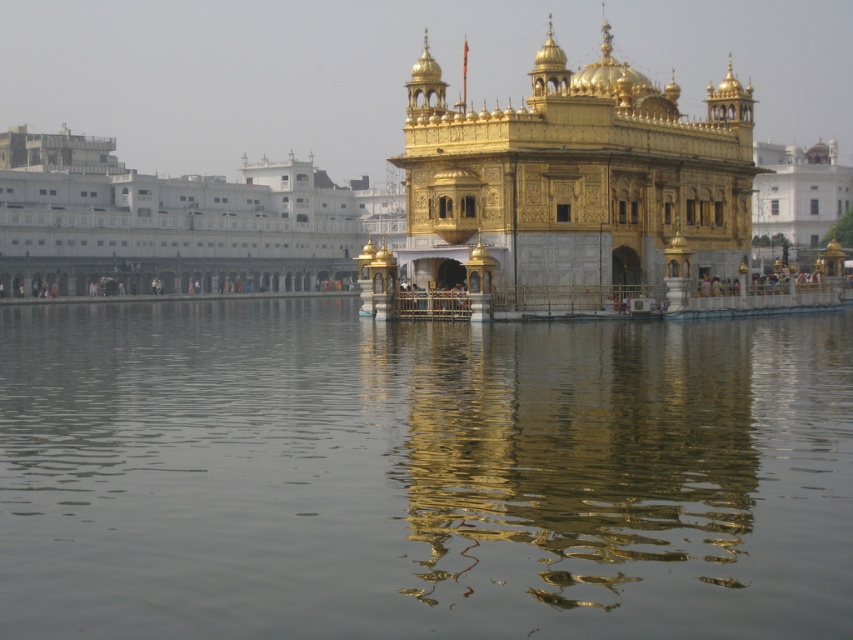
Can you confirm if transparent water at center is bigger than gold polished temple at center?

No.

Is transparent water at center further to camera compared to gold polished temple at center?

No, it is not.

I want to click on transparent water at center, so click(421, 474).